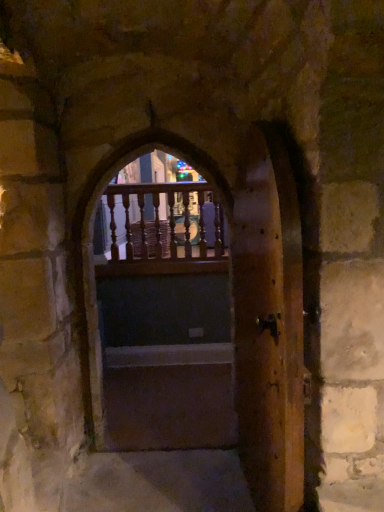
You are a GUI agent. You are given a task and a screenshot of the screen. Output one action in this format:
    pyautogui.click(x=<x>, y=<y>)
    Task: Click on the free point below wooden door at center, the second door positioned from the right (from a real-world perspective)
    
    Given the screenshot: What is the action you would take?
    pyautogui.click(x=177, y=436)